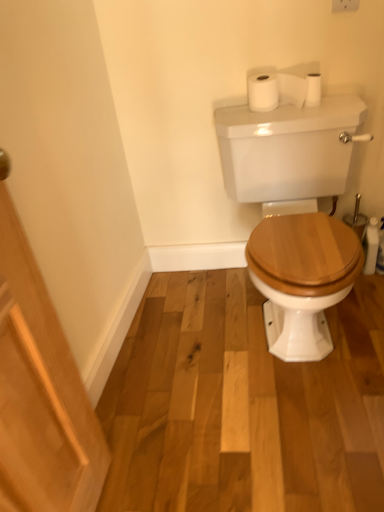
The height and width of the screenshot is (512, 384). Identify the location of vacant space situated on the left part of white glossy porcelain at center. (175, 345).